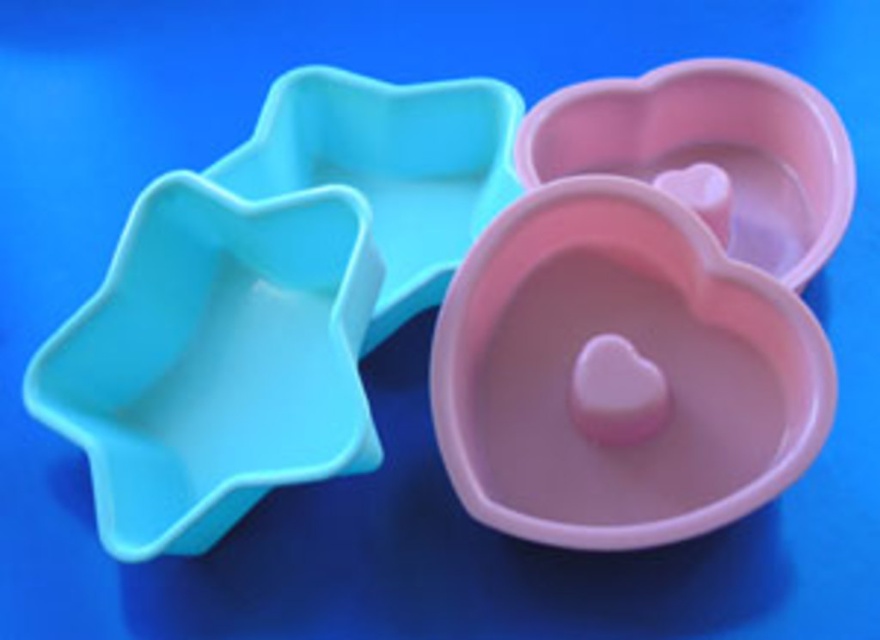
From the picture: Does pink matte heart-shaped bowl at center lie in front of matte blue star bowl at left?

Yes, it is in front of matte blue star bowl at left.

The width and height of the screenshot is (880, 640). In order to click on pink matte heart-shaped bowl at center in this screenshot , I will do `click(640, 352)`.

Between matte blue star at upper left and pink matte heart-shaped bowl at upper right, which one has more height?

Standing taller between the two is matte blue star at upper left.

Does point (433, 96) come closer to viewer compared to point (748, 240)?

No, (433, 96) is further to viewer.

This screenshot has width=880, height=640. I want to click on matte blue star at upper left, so click(387, 168).

Does pink matte heart-shaped bowl at center lie behind matte blue star at upper left?

No, it is in front of matte blue star at upper left.

Does pink matte heart-shaped bowl at center come in front of matte blue star at upper left?

Yes, it is.

This screenshot has width=880, height=640. In order to click on pink matte heart-shaped bowl at center in this screenshot , I will do `click(640, 352)`.

This screenshot has height=640, width=880. I want to click on pink matte heart-shaped bowl at center, so tap(640, 352).